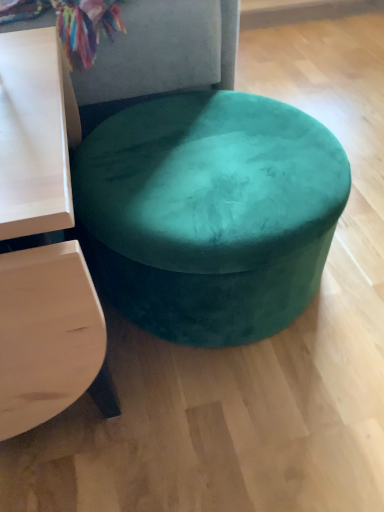
Where is `vacant space in front of teal velvet ottoman at center`? The width and height of the screenshot is (384, 512). vacant space in front of teal velvet ottoman at center is located at coordinates 244,420.